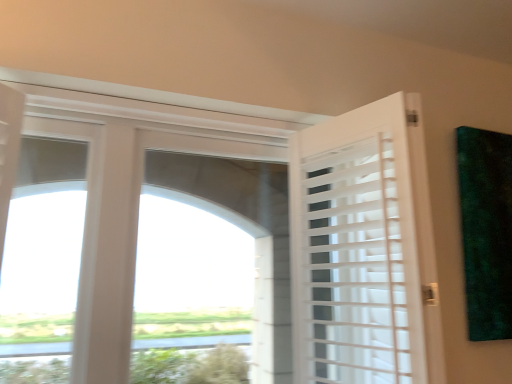
Question: Is green matte painting at upper right further to camera compared to white matte door at right?

Choices:
 (A) no
 (B) yes

Answer: (B)

Question: Does green matte painting at upper right have a lesser width compared to white matte door at right?

Choices:
 (A) no
 (B) yes

Answer: (B)

Question: From a real-world perspective, is green matte painting at upper right physically below white matte door at right?

Choices:
 (A) yes
 (B) no

Answer: (B)

Question: From the image's perspective, is green matte painting at upper right below white matte door at right?

Choices:
 (A) yes
 (B) no

Answer: (B)

Question: Is green matte painting at upper right at the left side of white matte door at right?

Choices:
 (A) no
 (B) yes

Answer: (A)

Question: Is green matte painting at upper right not within white matte door at right?

Choices:
 (A) yes
 (B) no

Answer: (A)

Question: Does white matte door at right have a smaller size compared to green matte painting at upper right?

Choices:
 (A) yes
 (B) no

Answer: (B)

Question: Is white matte door at right positioned behind green matte painting at upper right?

Choices:
 (A) yes
 (B) no

Answer: (B)

Question: Does white matte door at right appear on the left side of green matte painting at upper right?

Choices:
 (A) no
 (B) yes

Answer: (B)

Question: Is white matte door at right positioned beyond the bounds of green matte painting at upper right?

Choices:
 (A) no
 (B) yes

Answer: (B)

Question: Is white matte door at right wider than green matte painting at upper right?

Choices:
 (A) no
 (B) yes

Answer: (B)

Question: From the image's perspective, is white matte door at right on green matte painting at upper right?

Choices:
 (A) no
 (B) yes

Answer: (A)

Question: Is white matte door at right taller or shorter than green matte painting at upper right?

Choices:
 (A) tall
 (B) short

Answer: (A)